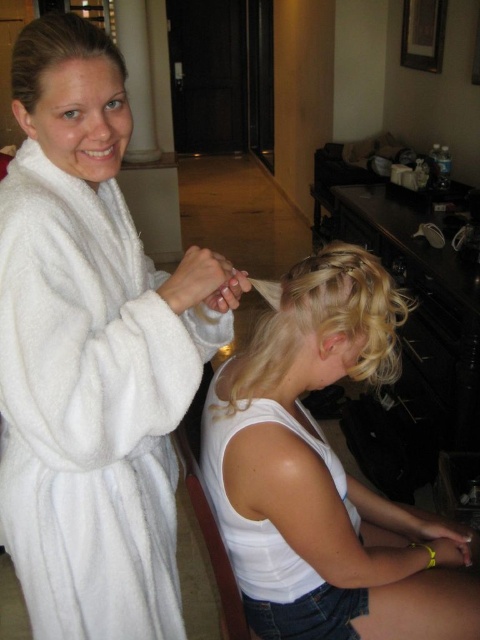
You are a hotel guest who just entered the room and see the white fluffy robe at left and the blonde hair at center. Which object is closer to the ceiling?

The white fluffy robe at left is located above the blonde hair at center, so it is closer to the ceiling.

You are a stylist observing two clients in a hotel room. One has blonde curly hair at center and the other has blonde silky hair at upper center. Which client has hair that is bigger in size?

The blonde curly hair at center is larger in size than the blonde silky hair at upper center.